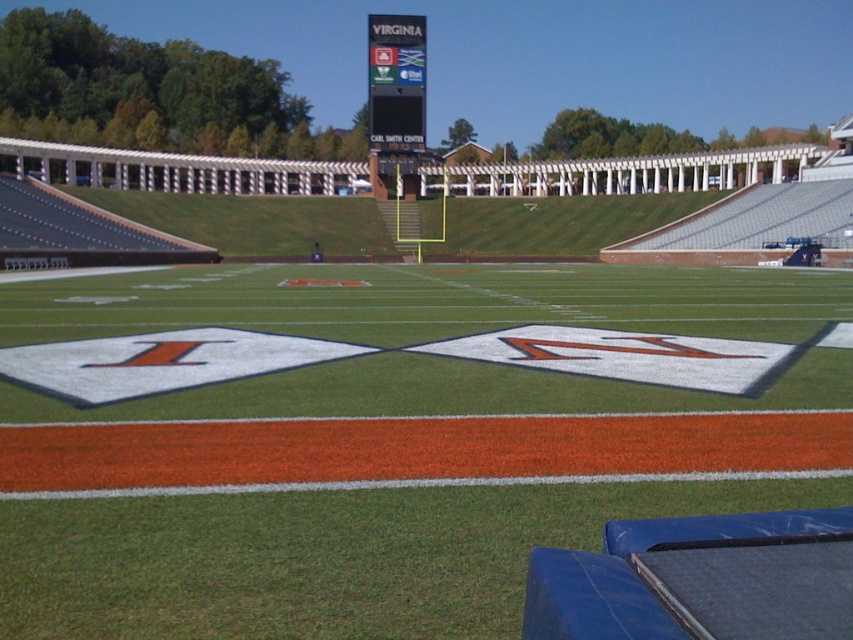
You are a photographer trying to capture the UVA logo on the green artificial turf at center while also including the black digital scoreboard at upper center in the shot. Based on their positions, can you tell me if the UVA logo is visible in the frame when the scoreboard is in view?

The green artificial turf at center is positioned under the black digital scoreboard at upper center, so the UVA logo on the green artificial turf at center should be visible below the scoreboard in the frame.

You are a photographer trying to capture the UVA logo on the field and the scoreboard. You are standing at the edge of the field. Which object, the green artificial turf at center or the black digital scoreboard at upper center, is positioned to the right side from your viewpoint?

The green artificial turf at center is positioned to the right of the black digital scoreboard at upper center, so the green artificial turf at center is on the right side from your viewpoint.